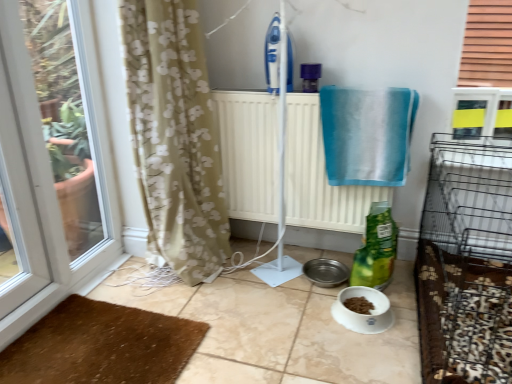
Identify the location of vacant area that lies between green matte bag at lower center and brown textured mat at lower left. This screenshot has width=512, height=384. (230, 316).